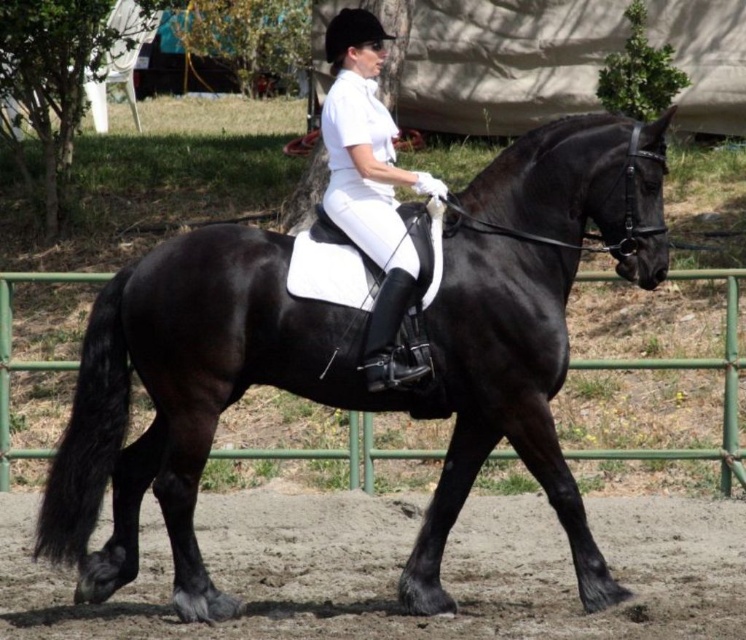
Question: Can you confirm if white matte riding pants at center is thinner than green metal fence at lower center?

Choices:
 (A) no
 (B) yes

Answer: (A)

Question: Based on their relative distances, which object is farther from the white matte riding pants at center?

Choices:
 (A) green metal fence at lower center
 (B) shiny black horse at center

Answer: (A)

Question: Is shiny black horse at center in front of green metal fence at lower center?

Choices:
 (A) no
 (B) yes

Answer: (B)

Question: Which object is the farthest from the shiny black horse at center?

Choices:
 (A) white matte riding pants at center
 (B) sandy dirt at lower center
 (C) green metal fence at lower center

Answer: (C)

Question: Which object appears closest to the camera in this image?

Choices:
 (A) shiny black horse at center
 (B) white matte riding pants at center
 (C) sandy dirt at lower center

Answer: (B)

Question: Can you confirm if shiny black horse at center is wider than sandy dirt at lower center?

Choices:
 (A) yes
 (B) no

Answer: (A)